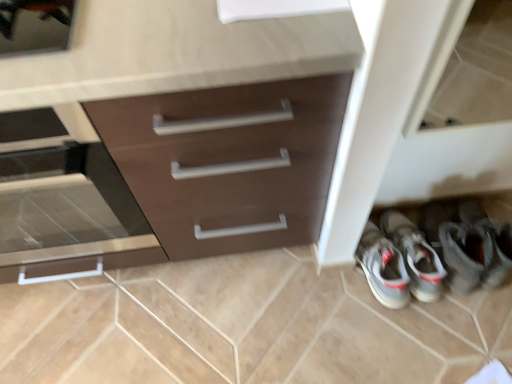
Image resolution: width=512 pixels, height=384 pixels. I want to click on free spot to the left of gray fabric sneakers at lower right, so click(x=314, y=295).